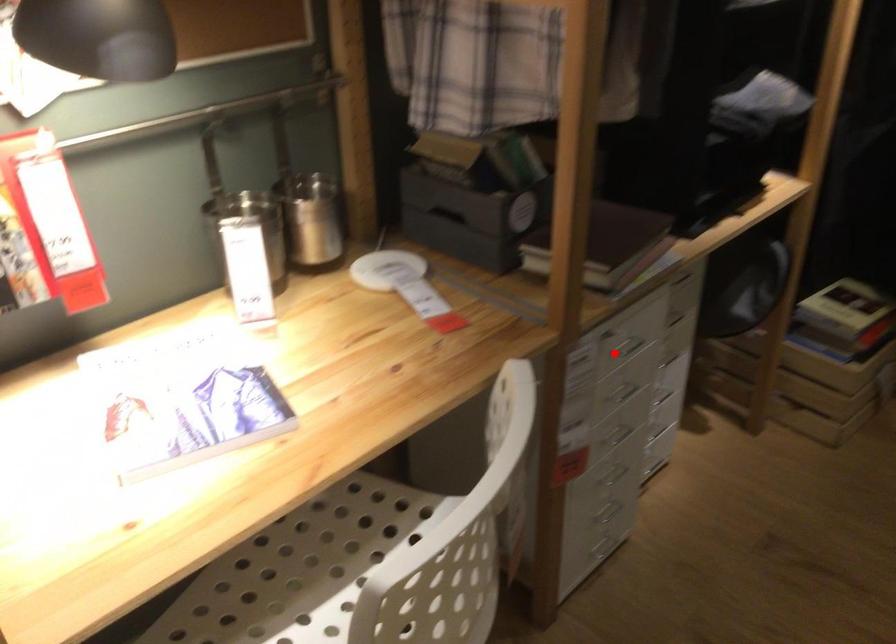
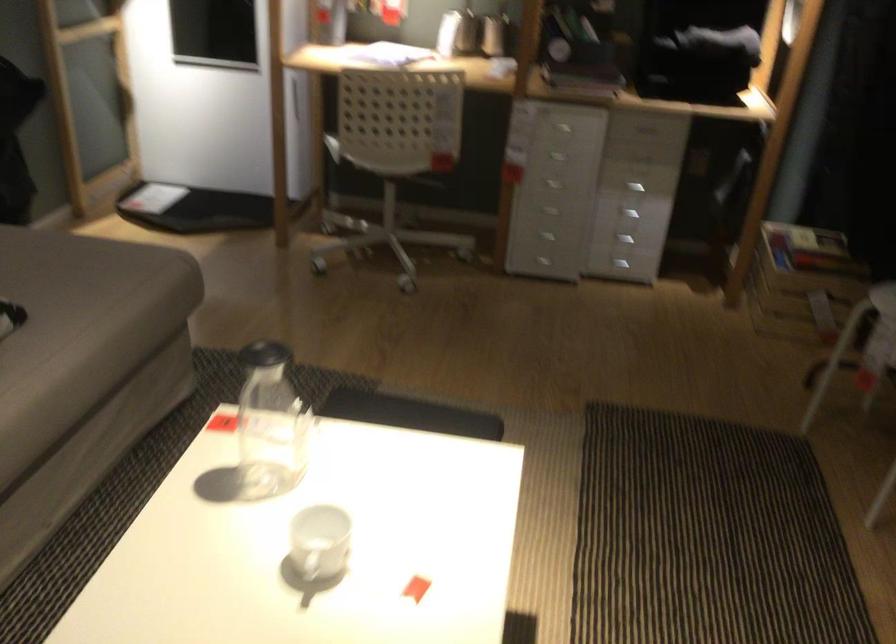
Question: I am providing you with two images of the same scene from different viewpoints. Image1 has a red point marked. In image2, the corresponding 3D location appears at what relative position? Reply with the corresponding letter.

Choices:
 (A) Closer
 (B) Farther

Answer: (B)